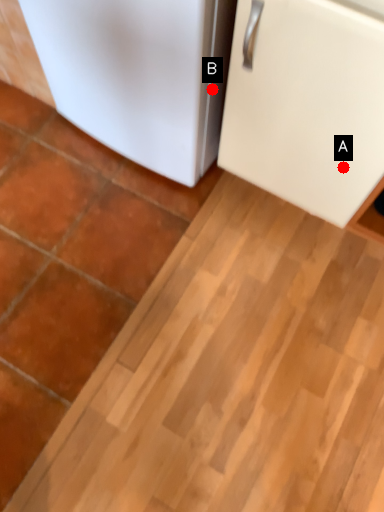
Question: Two points are circled on the image, labeled by A and B beside each circle. Among these points, which one is nearest to the camera?

Choices:
 (A) A is closer
 (B) B is closer

Answer: (A)